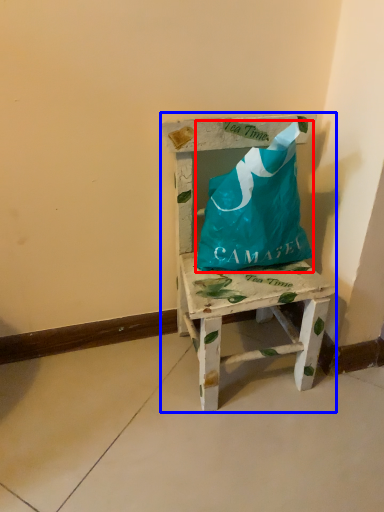
Question: Among these objects, which one is nearest to the camera, wrap (highlighted by a red box) or furniture (highlighted by a blue box)?

Choices:
 (A) wrap
 (B) furniture

Answer: (B)